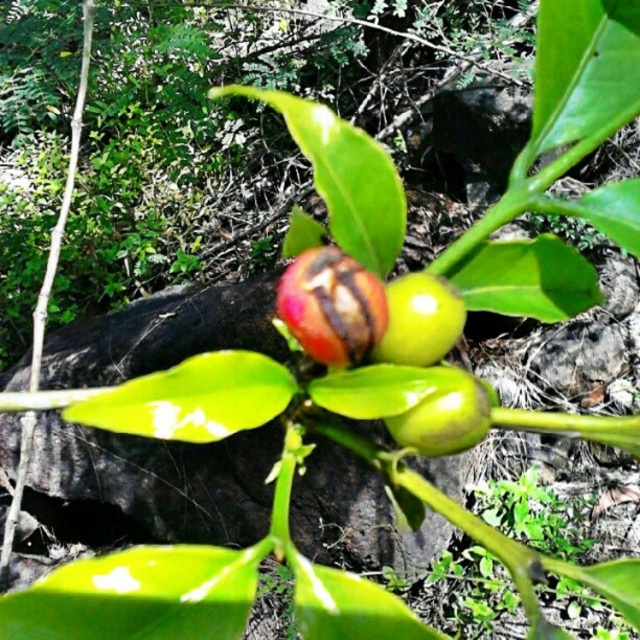
Question: Can you confirm if shiny red fruit at center is thinner than green glossy fruit at center?

Choices:
 (A) no
 (B) yes

Answer: (B)

Question: Which point is closer to the camera taking this photo?

Choices:
 (A) (428, 324)
 (B) (490, 404)

Answer: (B)

Question: Based on their relative distances, which object is nearer to the shiny red fruit at center?

Choices:
 (A) green matte fruit at center
 (B) green glossy fruit at center

Answer: (A)

Question: Can you confirm if shiny red fruit at center is positioned below green matte fruit at center?

Choices:
 (A) no
 (B) yes

Answer: (A)

Question: Which of the following is the closest to the observer?

Choices:
 (A) (304, 316)
 (B) (422, 400)

Answer: (B)

Question: Does shiny red fruit at center appear on the left side of green glossy fruit at center?

Choices:
 (A) yes
 (B) no

Answer: (A)